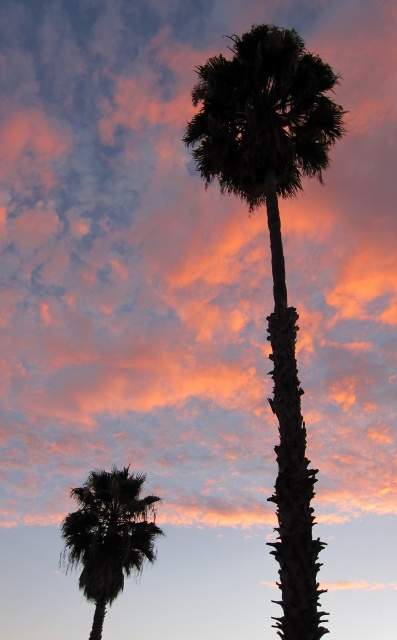
Does point (287, 504) lie in front of point (96, 472)?

Yes, point (287, 504) is closer to viewer.

Between silhouette palm tree at center and silhouette palm at lower left, which one is positioned higher?

Positioned higher is silhouette palm tree at center.

Who is more distant from viewer, (254,58) or (111,481)?

Point (111,481)

Identify the location of silhouette palm tree at center. Image resolution: width=397 pixels, height=640 pixels. (273, 250).